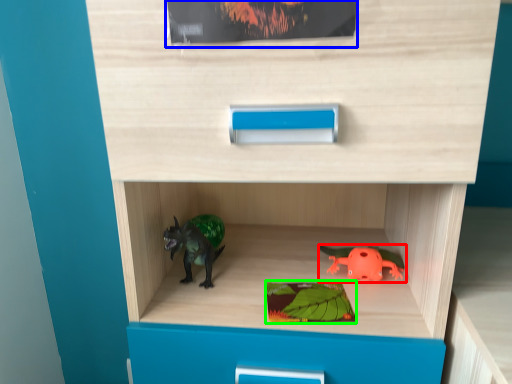
Question: Which is nearer to the toy (highlighted by a red box)? paperback book (highlighted by a blue box) or paperback book (highlighted by a green box).

Choices:
 (A) paperback book
 (B) paperback book

Answer: (B)